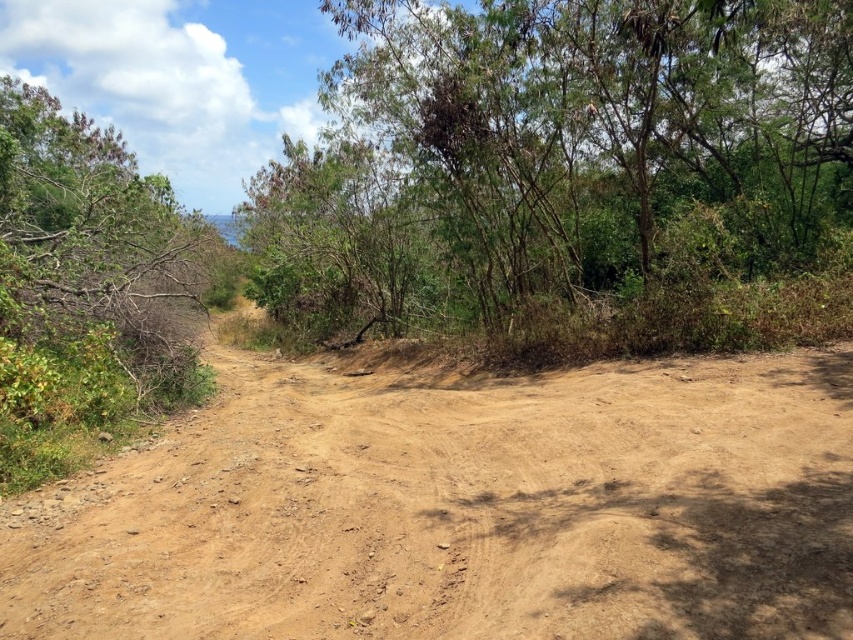
Who is lower down, brown sandy dirt at center or green leafy tree at upper center?

brown sandy dirt at center is below.

Between brown sandy dirt at center and green leafy tree at upper center, which one has more height?

Standing taller between the two is green leafy tree at upper center.

Who is more distant from viewer, (579, 492) or (271, 257)?

Positioned behind is point (271, 257).

This screenshot has width=853, height=640. I want to click on brown sandy dirt at center, so click(459, 508).